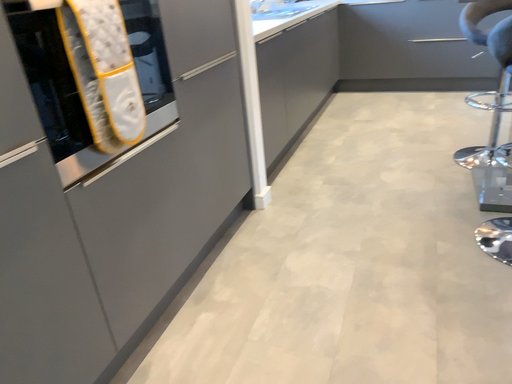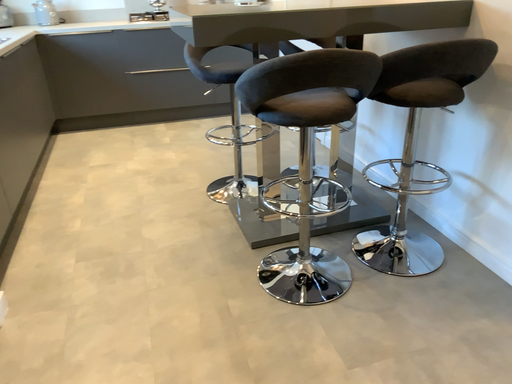
Question: Which way did the camera rotate in the video?

Choices:
 (A) rotated right
 (B) rotated left

Answer: (A)